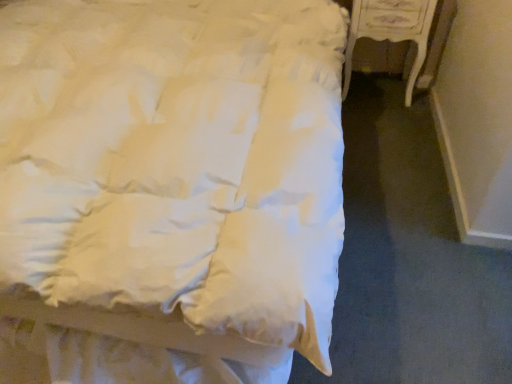
Question: Visually, is white satin bed at upper left positioned to the left or to the right of white glossy nightstand at right?

Choices:
 (A) right
 (B) left

Answer: (B)

Question: Looking at their shapes, would you say white satin bed at upper left is wider or thinner than white glossy nightstand at right?

Choices:
 (A) thin
 (B) wide

Answer: (B)

Question: Is point (217, 327) closer or farther from the camera than point (431, 24)?

Choices:
 (A) closer
 (B) farther

Answer: (A)

Question: Considering the positions of white glossy nightstand at right and white satin bed at upper left in the image, is white glossy nightstand at right taller or shorter than white satin bed at upper left?

Choices:
 (A) tall
 (B) short

Answer: (B)

Question: From the image's perspective, is white glossy nightstand at right located above or below white satin bed at upper left?

Choices:
 (A) above
 (B) below

Answer: (A)

Question: From a real-world perspective, is white glossy nightstand at right above or below white satin bed at upper left?

Choices:
 (A) above
 (B) below

Answer: (B)

Question: Is white glossy nightstand at right wider or thinner than white satin bed at upper left?

Choices:
 (A) thin
 (B) wide

Answer: (A)